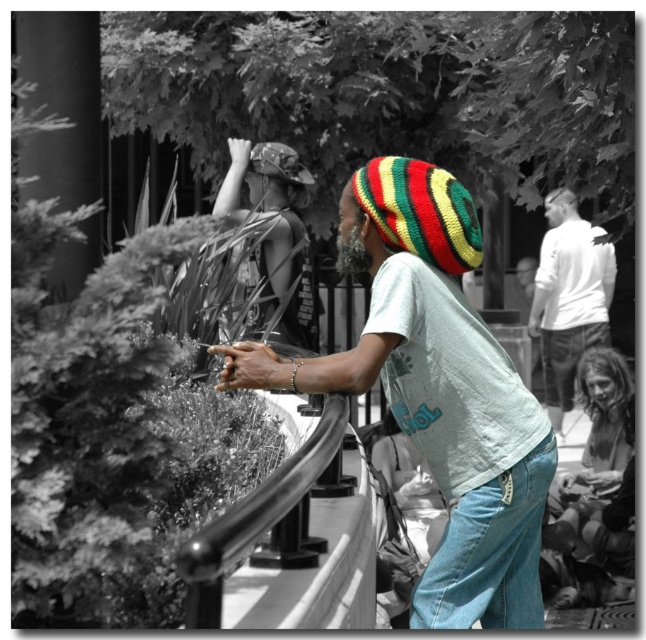
Who is more distant from viewer, (417, 228) or (557, 364)?

Point (557, 364)

Does knitted multicolored hat at center appear on the right side of white cotton shirt at upper right?

No, knitted multicolored hat at center is not to the right of white cotton shirt at upper right.

This screenshot has width=646, height=640. Find the location of `knitted multicolored hat at center`. knitted multicolored hat at center is located at coordinates (435, 390).